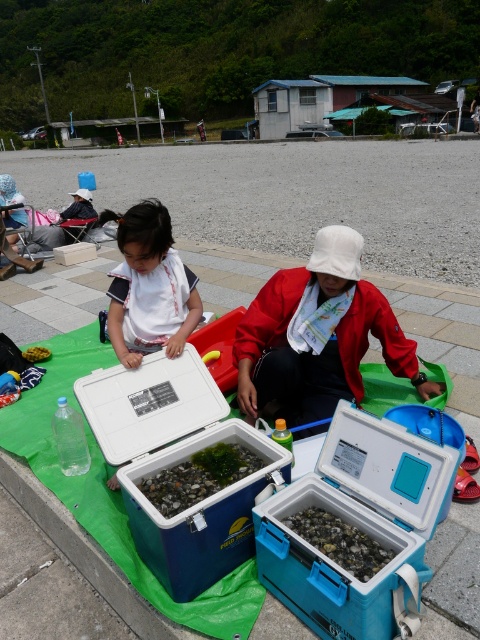
You are standing in the parking lot and want to place a small picnic basket between the blue plastic cooler at center and the paved stone pavement at center. Which object should you place it closer to if you want the basket to be more visible to someone approaching from the front?

The blue plastic cooler at center is closer to the viewer than the paved stone pavement at center, so placing the picnic basket closer to the blue plastic cooler at center would make it more visible to someone approaching from the front.

You are a photographer trying to capture a closeup of the green matte seaweed at center without obstructing the white cotton shirt at center. Based on their positions, is this possible?

The white cotton shirt at center is above green matte seaweed at center, so you can lower your camera angle to capture the green matte seaweed at center while avoiding the white cotton shirt at center.

You are planning to place a large picnic basket on the green tarp. Considering the blue plastic cooler at center and the paved stone pavement at center, which object will the picnic basket fit better on?

The blue plastic cooler at center is bigger than the paved stone pavement at center, so the picnic basket will fit better on the blue plastic cooler at center.